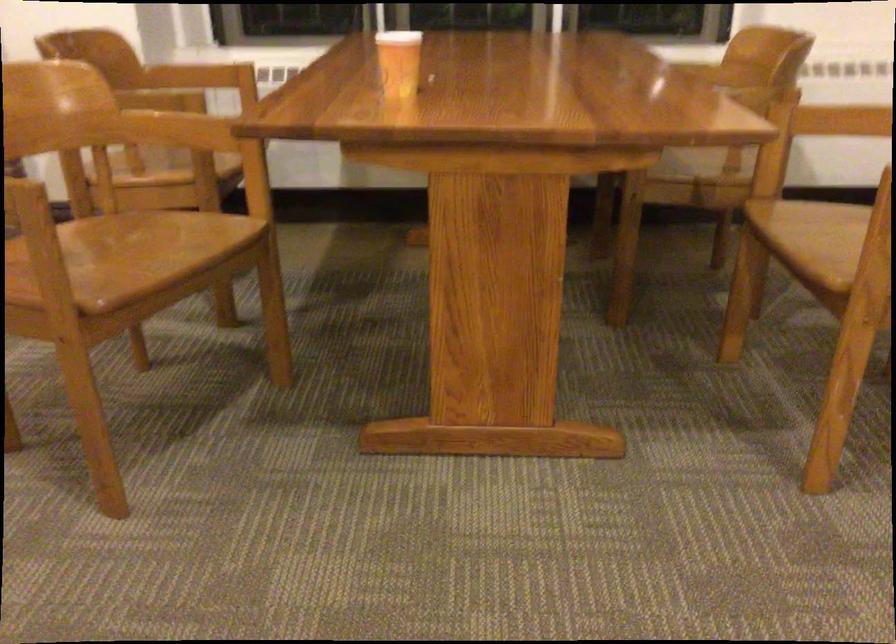
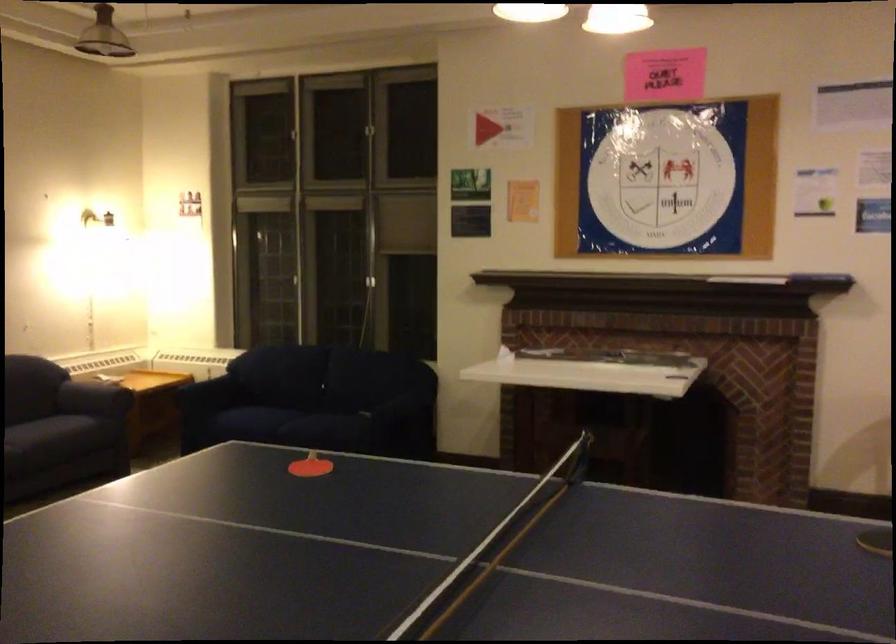
The images are taken continuously from a first-person perspective. In which direction are you moving?

The cameraman moved toward left, backward.